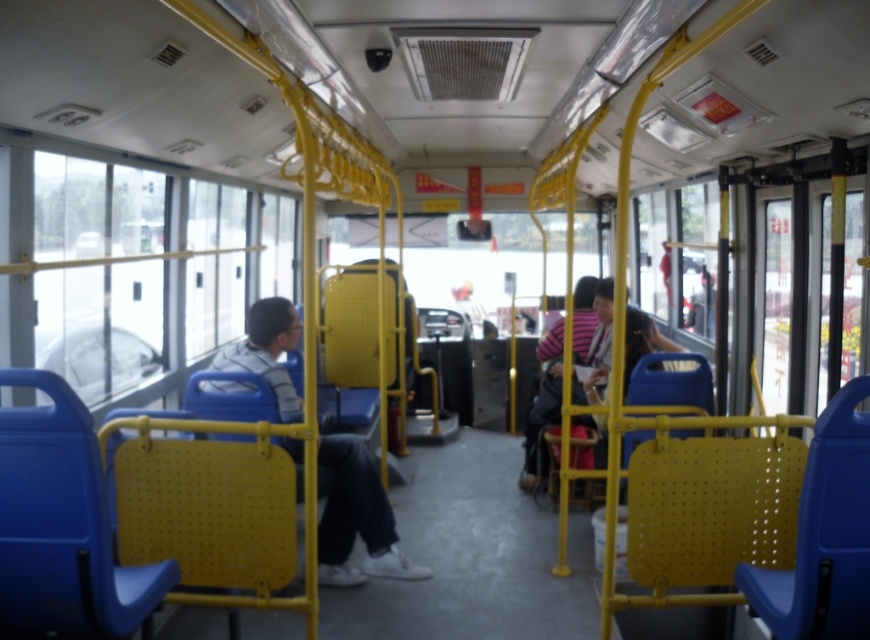
Does matte blue jeans at center appear over striped fabric shirt at center?

Incorrect, matte blue jeans at center is not positioned above striped fabric shirt at center.

Can you confirm if matte blue jeans at center is positioned to the left of striped fabric shirt at center?

Yes, matte blue jeans at center is to the left of striped fabric shirt at center.

Does point (292, 412) come closer to viewer compared to point (547, 353)?

That is True.

You are a GUI agent. You are given a task and a screenshot of the screen. Output one action in this format:
    pyautogui.click(x=<x>, y=<y>)
    Task: Click on the matte blue jeans at center
    The image size is (870, 640).
    Given the screenshot: What is the action you would take?
    pyautogui.click(x=355, y=516)